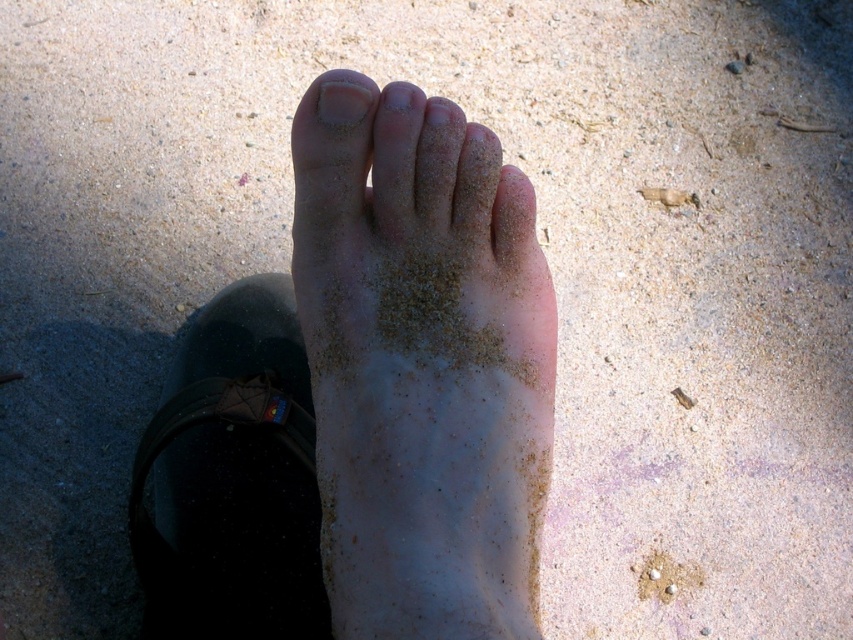
This screenshot has height=640, width=853. I want to click on pale skin foot at center, so 422,368.

Between point (355, 627) and point (341, 77), which one is positioned behind?

The point (341, 77) is behind.

Who is more forward, (374, 492) or (334, 99)?

Positioned in front is point (374, 492).

I want to click on pale skin foot at center, so click(422, 368).

Based on the photo, who is lower down, pale skin foot at center or white sandy footprint at lower center?

white sandy footprint at lower center

Is point (354, 211) less distant than point (662, 563)?

That is True.

I want to click on pale skin foot at center, so click(x=422, y=368).

Is matte black sandal at lower left closer to the viewer compared to white matte nail at upper center?

No.

The height and width of the screenshot is (640, 853). Describe the element at coordinates (231, 477) in the screenshot. I see `matte black sandal at lower left` at that location.

Does point (242, 525) come in front of point (351, 90)?

That is False.

Where is `matte black sandal at lower left`? matte black sandal at lower left is located at coordinates (231, 477).